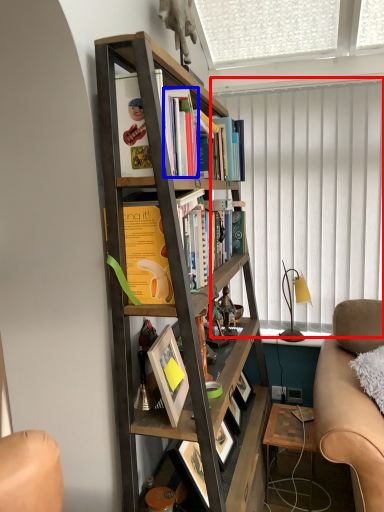
Question: Which point is closer to the camera, curtain (highlighted by a red box) or book (highlighted by a blue box)?

Choices:
 (A) curtain
 (B) book

Answer: (B)